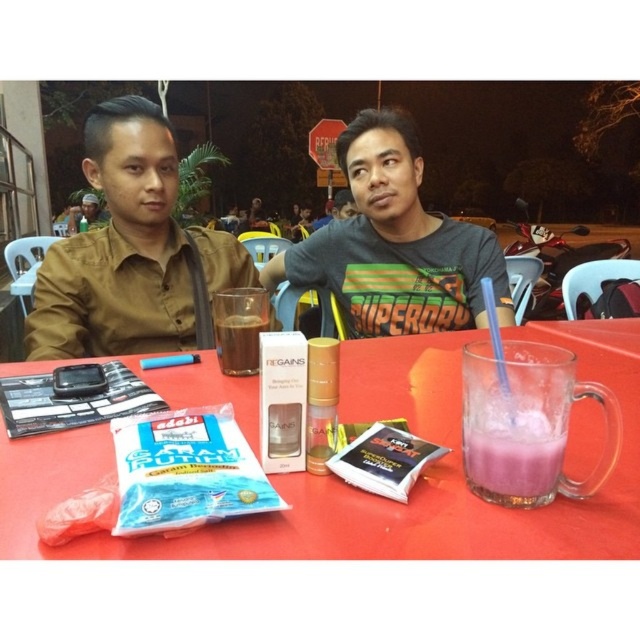
You are a waiter at a restaurant and need to place a 30 cm wide dessert plate between the transparent plastic table at center and the purple translucent glass at lower right. Can you fit the dessert plate in the space between them?

The transparent plastic table at center and the purple translucent glass at lower right are 28.91 centimeters apart. Since the dessert plate is 30 cm wide, it cannot fit in the space between them as the distance is smaller than the plate.

You are a photographer setting up a shot of the scene. You want to ensure the transparent plastic table at center and the matte black shirt at left are both clearly visible. Which object should you focus on first to ensure depth of field captures both?

The transparent plastic table at center is in front of the matte black shirt at left, so focusing on the matte black shirt at left first will ensure the transparent plastic table at center remains in focus as well due to its closer proximity to the camera.